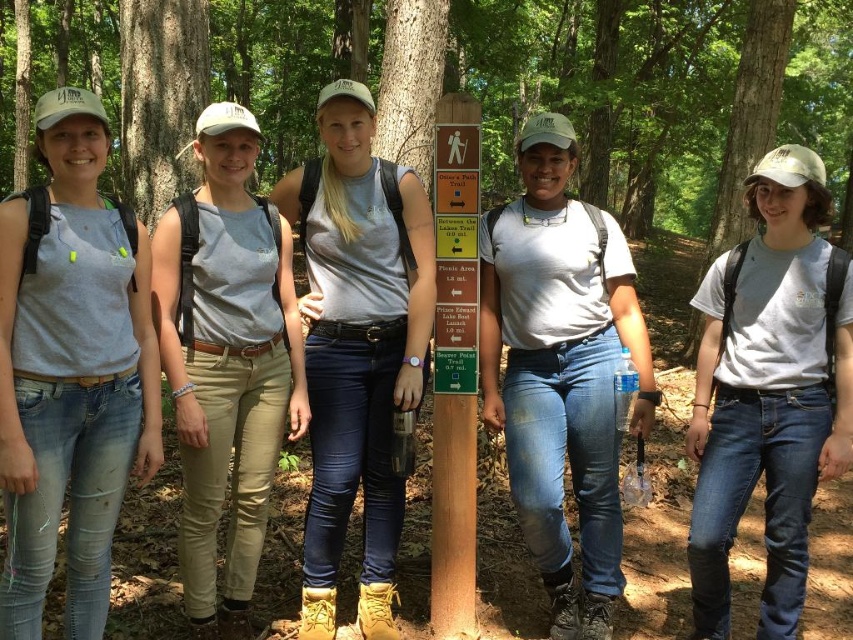
Can you confirm if blue jeans at center is positioned to the right of white cotton t-shirt at center?

Incorrect, blue jeans at center is not on the right side of white cotton t-shirt at center.

Is blue jeans at center thinner than white cotton t-shirt at center?

Incorrect, blue jeans at center's width is not less than white cotton t-shirt at center's.

Is point (552, 259) behind point (772, 410)?

Yes, point (552, 259) is behind point (772, 410).

Where is `blue jeans at center`? This screenshot has height=640, width=853. blue jeans at center is located at coordinates (561, 371).

Can you confirm if matte gray tank top at left is wider than matte gray shirt at center?

No.

Does point (152, 388) come farther from viewer compared to point (357, 356)?

No, it is in front of (357, 356).

Identify the location of matte gray tank top at left. This screenshot has width=853, height=640. (70, 369).

Who is more distant from viewer, (64, 156) or (547, 349)?

Point (547, 349)

Can you confirm if matte gray tank top at left is positioned above blue jeans at center?

Yes.

Which is behind, point (56, 115) or point (531, 426)?

Point (531, 426)

Locate an element on the screen. This screenshot has width=853, height=640. matte gray tank top at left is located at coordinates (70, 369).